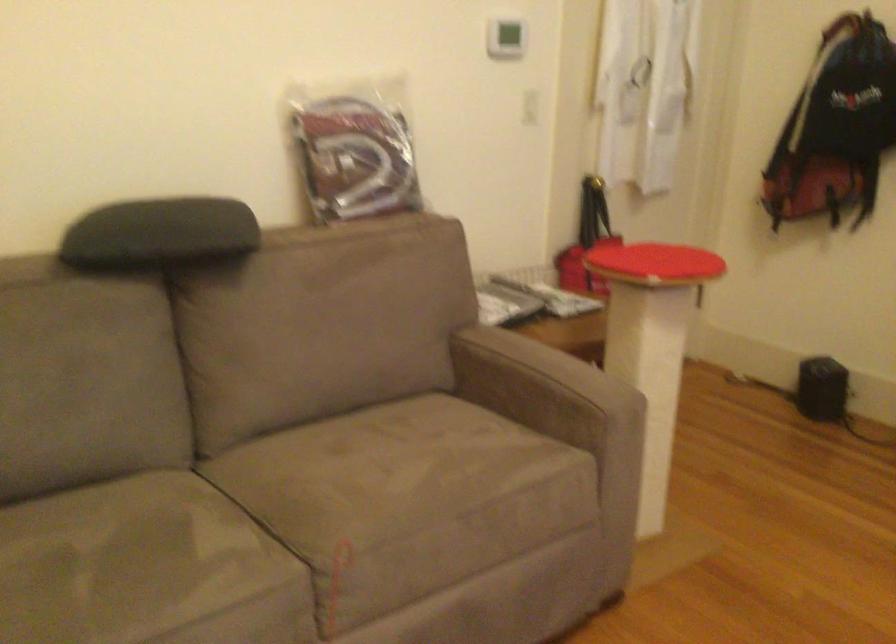
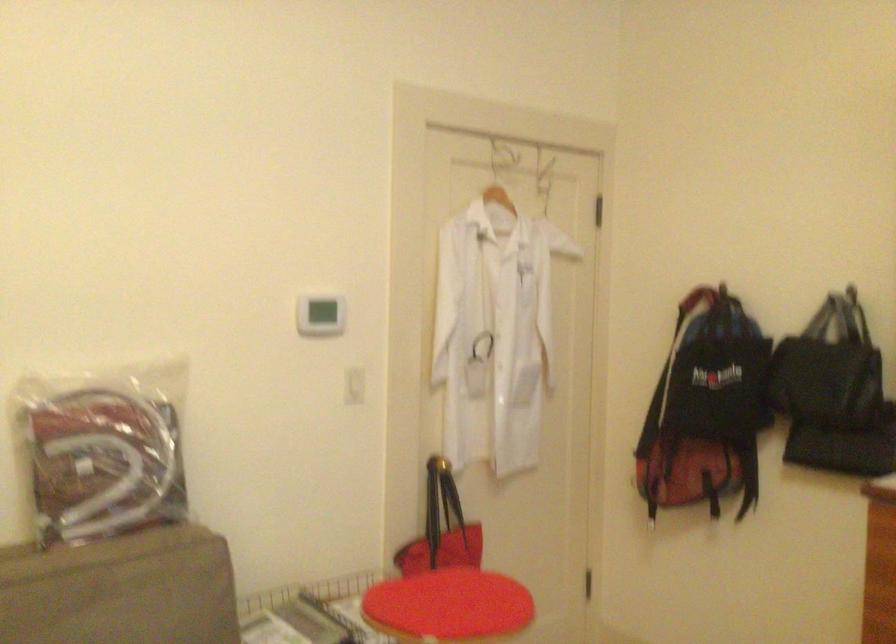
Question: The images are taken continuously from a first-person perspective. In which direction is your viewpoint rotating?

Choices:
 (A) Left
 (B) Right
 (C) Up
 (D) Down

Answer: (C)